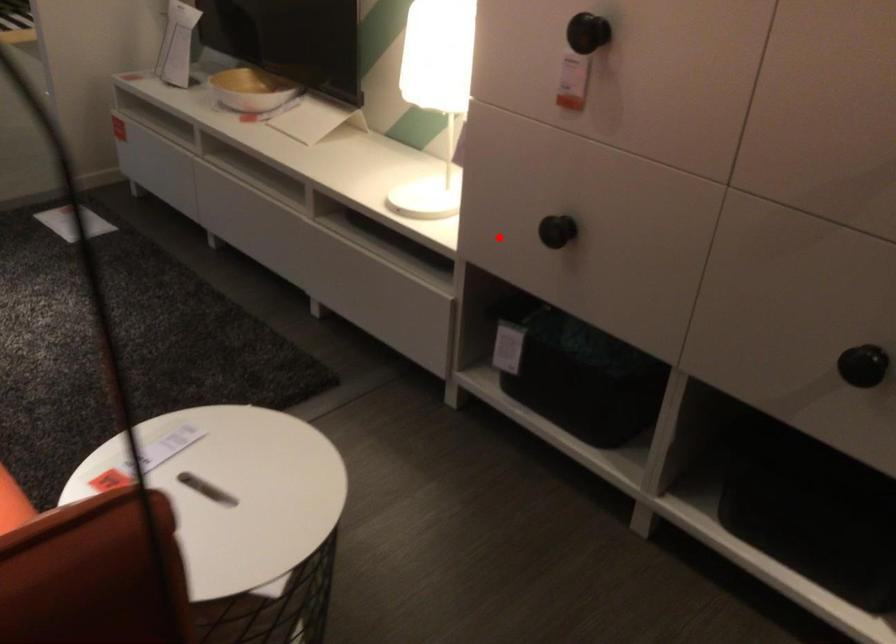
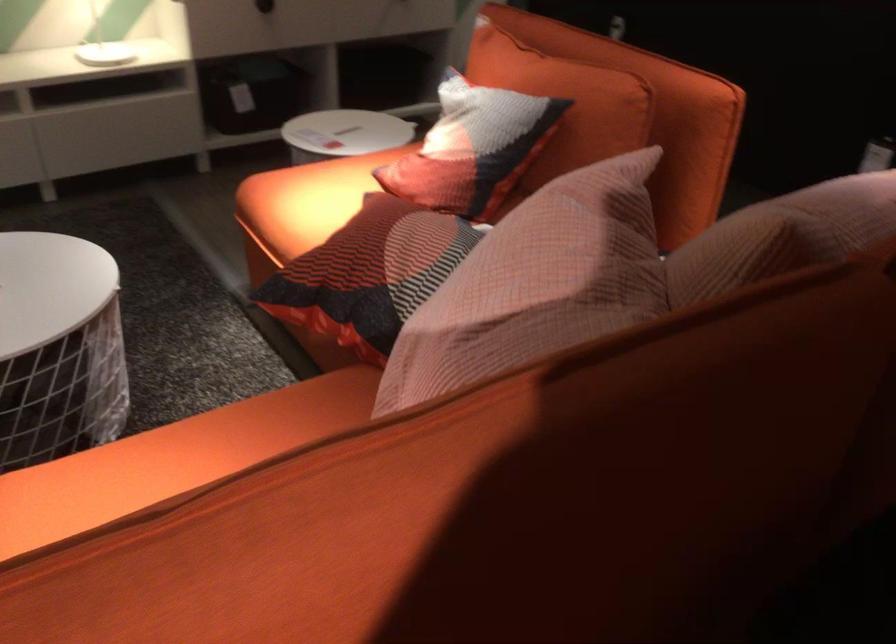
Question: I am providing you with two images of the same scene from different viewpoints. A red point is marked on the first image. Can you still see the location of the red point in image 2?

Choices:
 (A) Yes
 (B) No

Answer: (A)